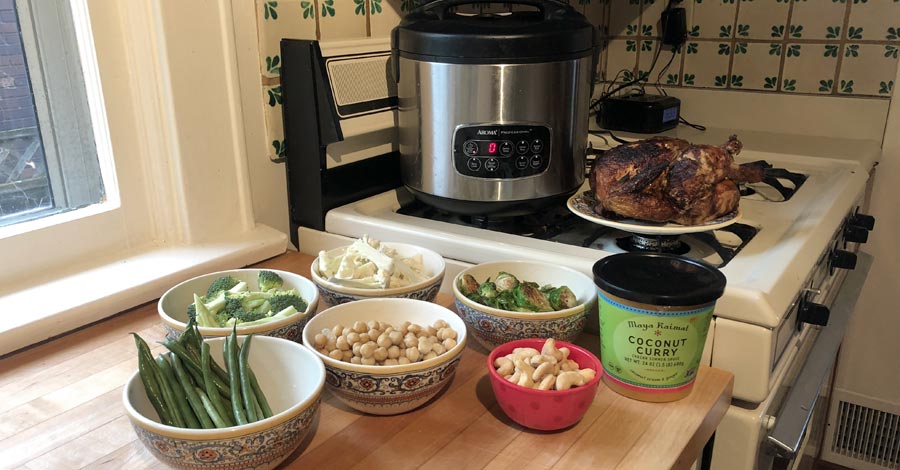
The image size is (900, 470). What are the coordinates of `bowls` in the screenshot? It's located at (295, 372), (173, 297), (381, 313), (471, 308), (515, 393).